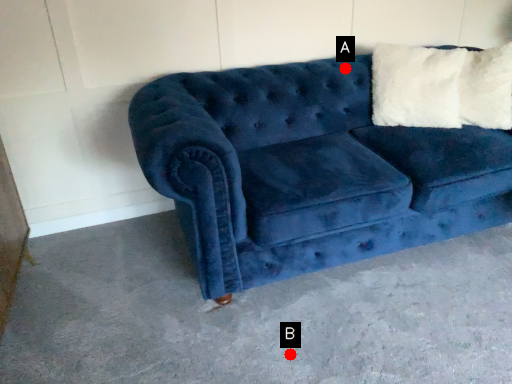
Question: Two points are circled on the image, labeled by A and B beside each circle. Which point appears farthest from the camera in this image?

Choices:
 (A) A is further
 (B) B is further

Answer: (A)